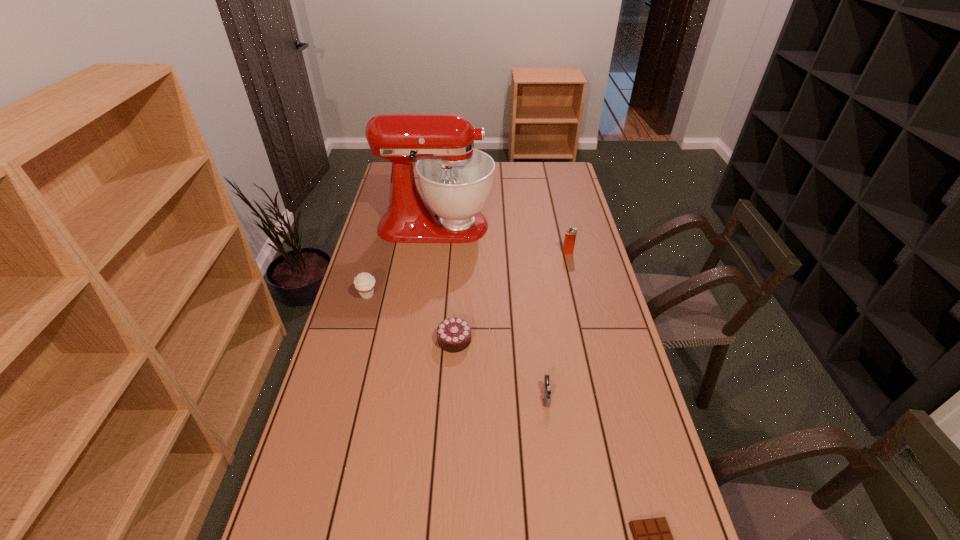
This screenshot has width=960, height=540. What are the coordinates of `free space at the far right corner of the desktop` in the screenshot? It's located at (540, 164).

In order to click on vacant space in between the third object from right to left and the right igniter in this screenshot , I will do (x=557, y=324).

The width and height of the screenshot is (960, 540). What are the coordinates of `vacant area that lies between the tallest object and the fifth tallest object` in the screenshot? It's located at (445, 283).

This screenshot has height=540, width=960. Identify the location of vacant point located between the taller igniter and the farthest object. (502, 239).

In order to click on vacant space in between the mixer and the left igniter in this screenshot , I will do click(492, 310).

Where is `the fifth closest object to the shortest object`? The image size is (960, 540). the fifth closest object to the shortest object is located at coordinates point(455,179).

Locate which object is the fourth closest to the farther igniter. Please provide its 2D coordinates. Your answer should be formatted as a tuple, i.e. [(x, y)], where the tuple contains the x and y coordinates of a point satisfying the conditions above.

[(364, 283)]

The width and height of the screenshot is (960, 540). I want to click on free space that satisfies the following two spatial constraints: 1. at the attachment hub of the second shortest object; 2. on the right side of the farthest object, so click(x=421, y=340).

At what (x,y) coordinates should I click in order to perform the action: click on blank space that satisfies the following two spatial constraints: 1. at the attachment hub of the third object from right to left; 2. on the right side of the farthest object. Please return your answer as a coordinate pair (x, y). Looking at the image, I should click on point(415,395).